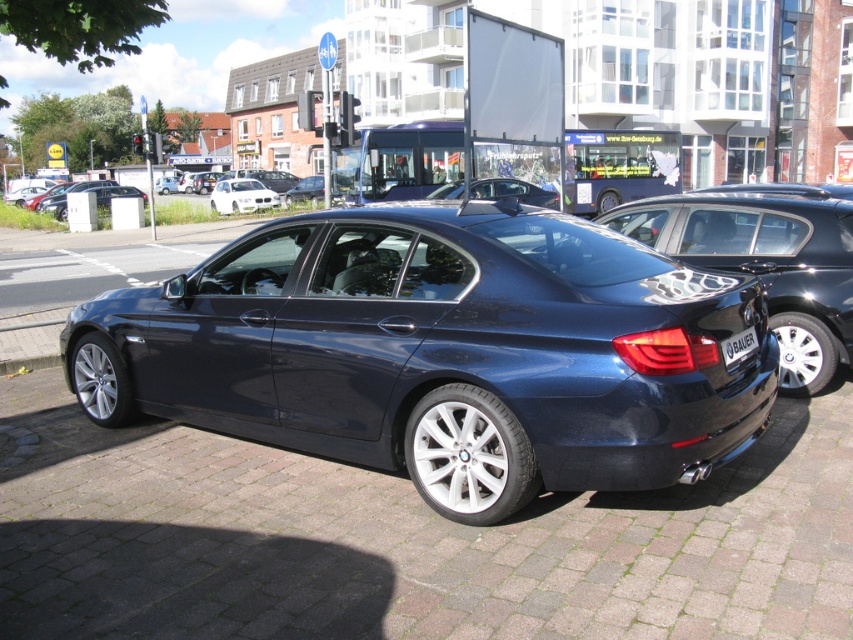
Question: Which point is closer to the camera?

Choices:
 (A) (236, 186)
 (B) (386, 355)
 (C) (838, 230)
 (D) (729, 360)

Answer: (D)

Question: Can you confirm if white glossy sedan at upper center is positioned above black plastic license plate at rear?

Choices:
 (A) yes
 (B) no

Answer: (A)

Question: Does satin dark blue sedan at center lie behind glossy dark blue sedan at center?

Choices:
 (A) no
 (B) yes

Answer: (A)

Question: Which object is positioned farthest from the glossy dark blue sedan at center?

Choices:
 (A) white glossy sedan at upper center
 (B) black plastic license plate at rear

Answer: (A)

Question: Among these objects, which one is farthest from the camera?

Choices:
 (A) white glossy sedan at upper center
 (B) black plastic license plate at rear

Answer: (A)

Question: Is satin dark blue sedan at center below glossy dark blue sedan at center?

Choices:
 (A) no
 (B) yes

Answer: (B)